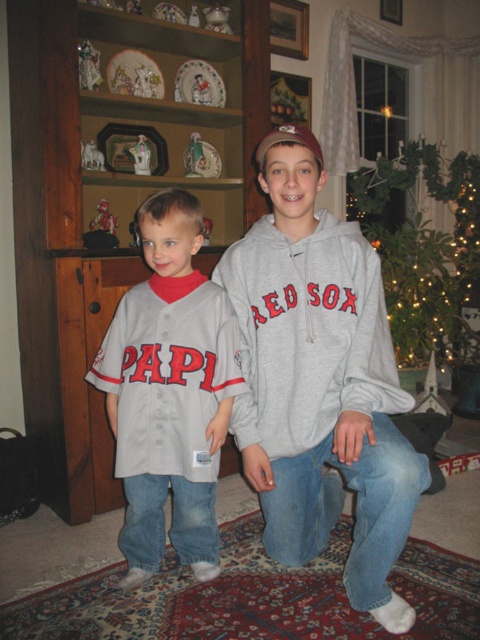
Question: Is gray cotton hoodie at center to the right of gray fabric baseball jersey at center from the viewer's perspective?

Choices:
 (A) yes
 (B) no

Answer: (A)

Question: Which of the following is the farthest from the observer?

Choices:
 (A) (130, 396)
 (B) (381, 346)

Answer: (A)

Question: Considering the real-world distances, which object is closest to the iridescent glass ornaments at upper right?

Choices:
 (A) gray fabric baseball jersey at center
 (B) gray cotton hoodie at center

Answer: (B)

Question: Where is gray cotton sweatshirt at center located in relation to iridescent glass ornaments at upper right in the image?

Choices:
 (A) right
 (B) left

Answer: (B)

Question: Which object is closer to the camera taking this photo?

Choices:
 (A) gray cotton sweatshirt at center
 (B) gray cotton hoodie at center
 (C) gray fabric baseball jersey at center
 (D) iridescent glass ornaments at upper right

Answer: (B)

Question: Is gray fabric baseball jersey at center positioned behind iridescent glass ornaments at upper right?

Choices:
 (A) no
 (B) yes

Answer: (A)